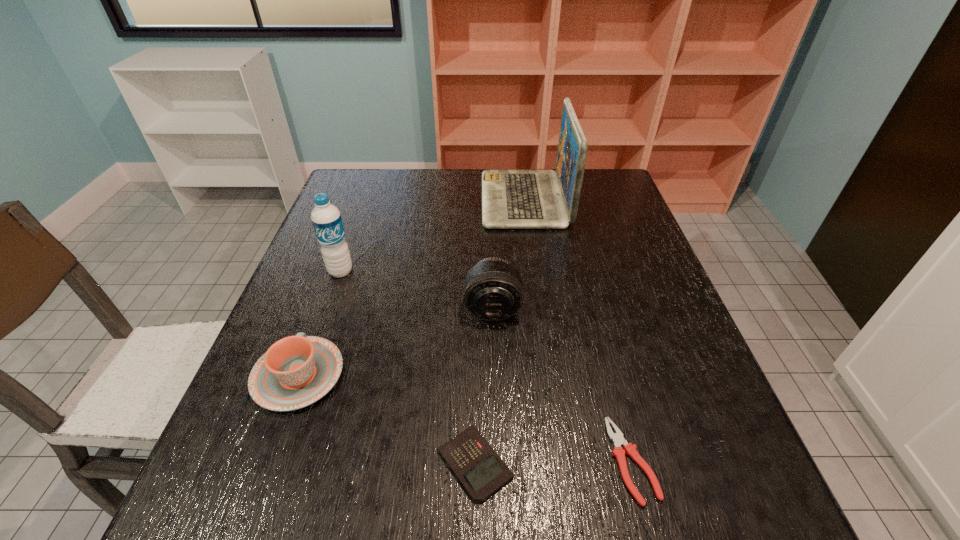
Locate an element on the screen. The width and height of the screenshot is (960, 540). free space between the farthest object and the pliers is located at coordinates (578, 330).

Identify the location of vacant space that's between the third tallest object and the second tallest object. (417, 290).

I want to click on free space between the telephoto lens and the fifth shortest object, so click(417, 290).

The image size is (960, 540). Identify the location of the third closest object to the water bottle. (511, 199).

This screenshot has height=540, width=960. Identify the location of the fourth closest object to the fifth nearest object. (481, 471).

What are the coordinates of `vacant area that satisfies the following two spatial constraints: 1. on the screen of the farthest object; 2. on the front-facing side of the telephoto lens` in the screenshot? It's located at (540, 308).